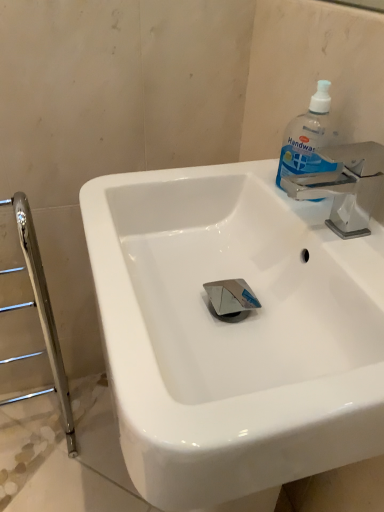
Question: Considering the relative sizes of transparent plastic handwash at upper right and white glossy sink at center in the image provided, is transparent plastic handwash at upper right wider than white glossy sink at center?

Choices:
 (A) yes
 (B) no

Answer: (B)

Question: Are transparent plastic handwash at upper right and white glossy sink at center located far from each other?

Choices:
 (A) no
 (B) yes

Answer: (A)

Question: From the image's perspective, is transparent plastic handwash at upper right located beneath white glossy sink at center?

Choices:
 (A) yes
 (B) no

Answer: (B)

Question: Does transparent plastic handwash at upper right have a larger size compared to white glossy sink at center?

Choices:
 (A) no
 (B) yes

Answer: (A)

Question: Is transparent plastic handwash at upper right to the right of white glossy sink at center from the viewer's perspective?

Choices:
 (A) no
 (B) yes

Answer: (B)

Question: Is white glossy sink at center completely or partially inside transparent plastic handwash at upper right?

Choices:
 (A) yes
 (B) no

Answer: (B)

Question: Is white glossy sink at center behind transparent plastic handwash at upper right?

Choices:
 (A) yes
 (B) no

Answer: (B)

Question: From the image's perspective, is white glossy sink at center over transparent plastic handwash at upper right?

Choices:
 (A) no
 (B) yes

Answer: (A)

Question: Could transparent plastic handwash at upper right be considered to be inside white glossy sink at center?

Choices:
 (A) yes
 (B) no

Answer: (A)

Question: Can we say white glossy sink at center lies outside transparent plastic handwash at upper right?

Choices:
 (A) no
 (B) yes

Answer: (B)

Question: From a real-world perspective, is white glossy sink at center physically below transparent plastic handwash at upper right?

Choices:
 (A) yes
 (B) no

Answer: (A)

Question: Can you confirm if white glossy sink at center is smaller than transparent plastic handwash at upper right?

Choices:
 (A) yes
 (B) no

Answer: (B)

Question: Considering the positions of point (334, 163) and point (178, 280), is point (334, 163) closer or farther from the camera than point (178, 280)?

Choices:
 (A) closer
 (B) farther

Answer: (B)